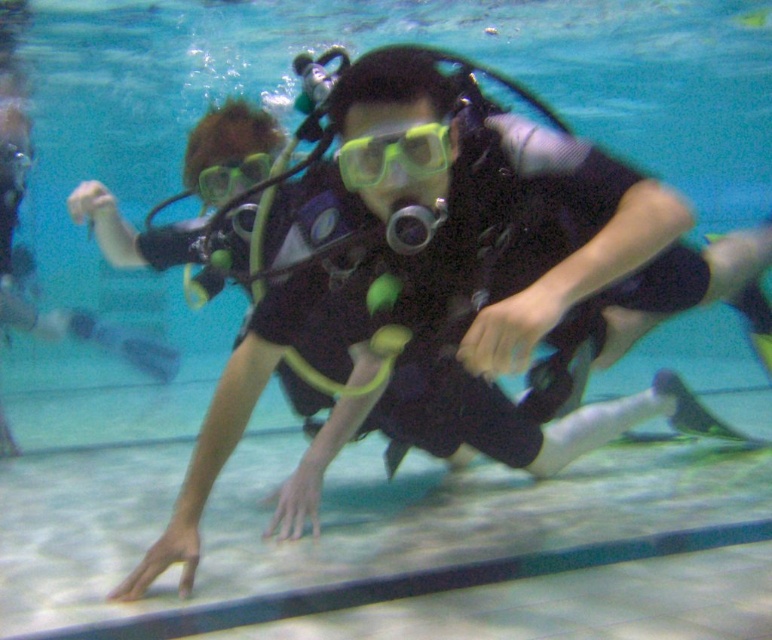
Measure the distance between yellow matte/glossy goggles at center and green matte/glossy goggles at center.

34.60 inches

Is yellow matte/glossy goggles at center to the right of green matte/glossy goggles at center from the viewer's perspective?

Correct, you'll find yellow matte/glossy goggles at center to the right of green matte/glossy goggles at center.

At what (x,y) coordinates should I click in order to perform the action: click on yellow matte/glossy goggles at center. Please return your answer as a coordinate pair (x, y). The image size is (772, 640). Looking at the image, I should click on (394, 156).